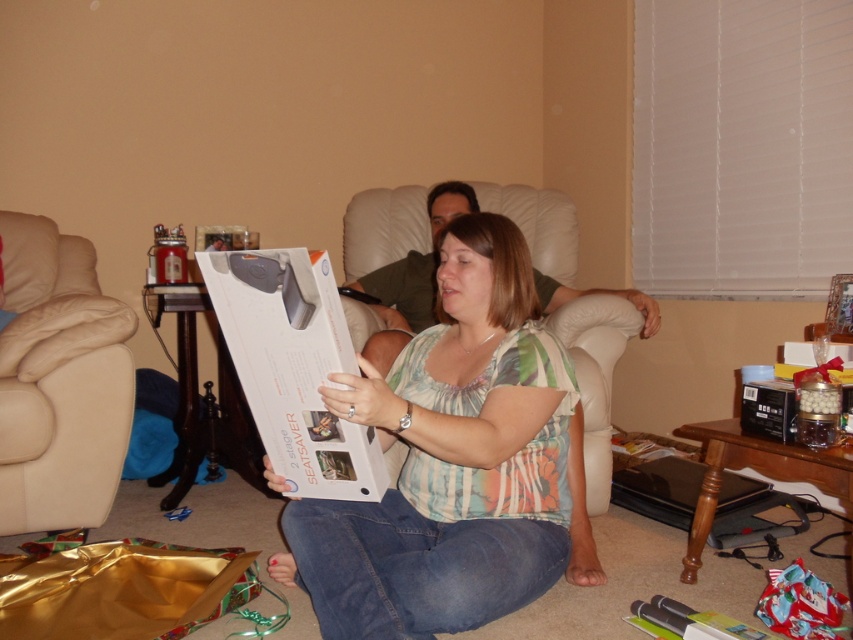
You are a delivery person who just arrived at a house to deliver a package. You see the white paperboard box at center and the white leather armchair at center. Which object is taller?

The white leather armchair at center is taller than the white paperboard box at center.

You are a furniture delivery person who just arrived at a house. You have a new sofa that is 1.8 meters tall. The living room has a leather at left and a white leather armchair at center. Can you place the new sofa between them without exceeding the height limit?

The leather at left is not as tall as the white leather armchair at center. Since the white leather armchair at center is taller than the leather at left, the new sofa at 1.8 meters must be compared to the tallest object. If the white leather armchair at center is taller than 1.8 meters, then the sofa cannot be placed. However, if it is shorter, then it can. But since the exact height isn

You are trying to decide where to place a new large sculpture that requires a space bigger than the white cardboard box at center. According to the scene, can the white leather armchair at center accommodate it?

The white leather armchair at center is larger in size than the white cardboard box at center. Therefore, the sculpture requiring space bigger than the box can be placed on the white leather armchair at center as it has sufficient space.